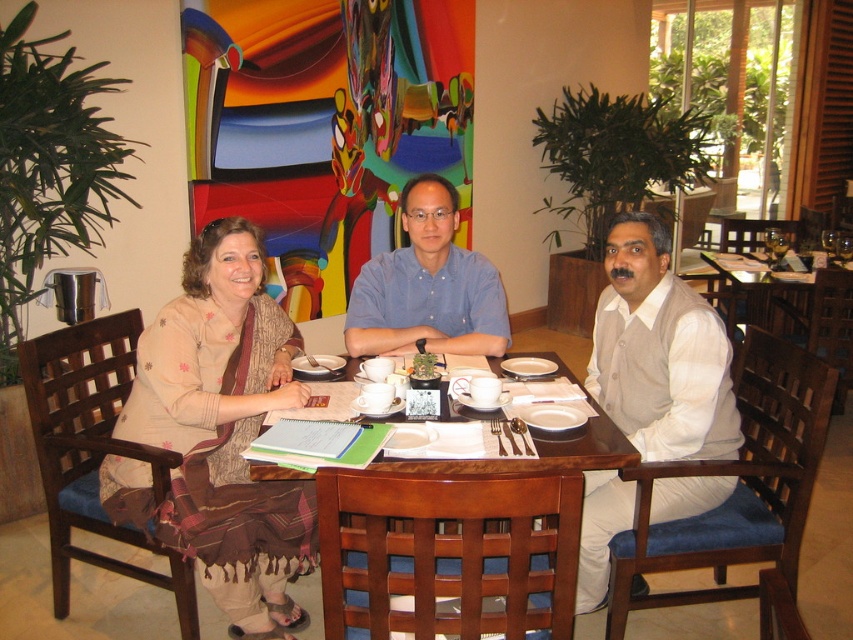
Question: Estimate the real-world distances between objects in this image. Which object is farther from the wooden table at center?

Choices:
 (A) white glossy mug at center
 (B) blue button-down shirt at center

Answer: (B)

Question: Which of the following is the closest to the observer?

Choices:
 (A) white glossy mug at center
 (B) blue button-down shirt at center
 (C) beige fabric saree at left

Answer: (A)

Question: Does blue button-down shirt at center appear over white glossy mug at center?

Choices:
 (A) yes
 (B) no

Answer: (A)

Question: Does blue button-down shirt at center have a smaller size compared to white glossy mug at center?

Choices:
 (A) no
 (B) yes

Answer: (A)

Question: Does beige fabric saree at left have a larger size compared to white glossy mug at center?

Choices:
 (A) yes
 (B) no

Answer: (A)

Question: Estimate the real-world distances between objects in this image. Which object is farther from the white glossy mug at center?

Choices:
 (A) beige fabric saree at left
 (B) wooden table at center
 (C) blue button-down shirt at center

Answer: (A)